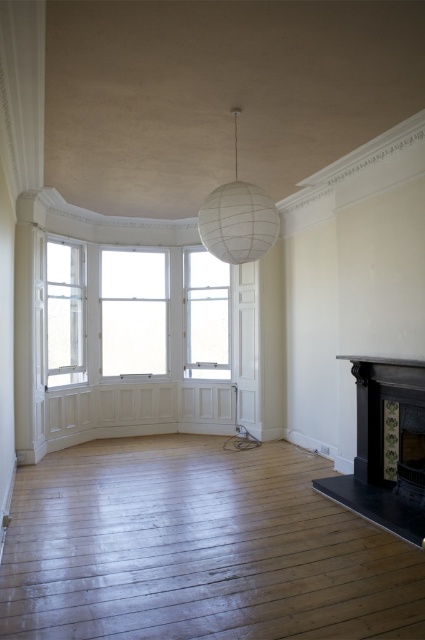
You are standing in the room and see two points marked on the wall. The first is at point (116,262) and the second is at point (217,268). Which point is closer to you?

Point (116,262) is closer to the viewer than point (217,268).

You are standing in the room and want to look outside through both the clear glass window at center and the clear glass window at left. Which window can you see through from your current position?

The clear glass window at left is behind the clear glass window at center, so you can only see through the clear glass window at center directly. The clear glass window at left is blocked by the clear glass window at center.